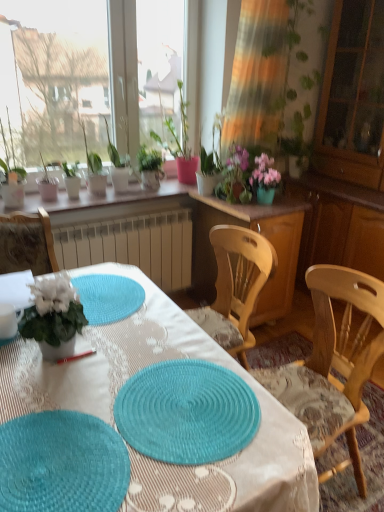
Identify the location of free point above teal woven placemat at center, the 2th mat positioned from the left (from a real-world perspective). (190, 400).